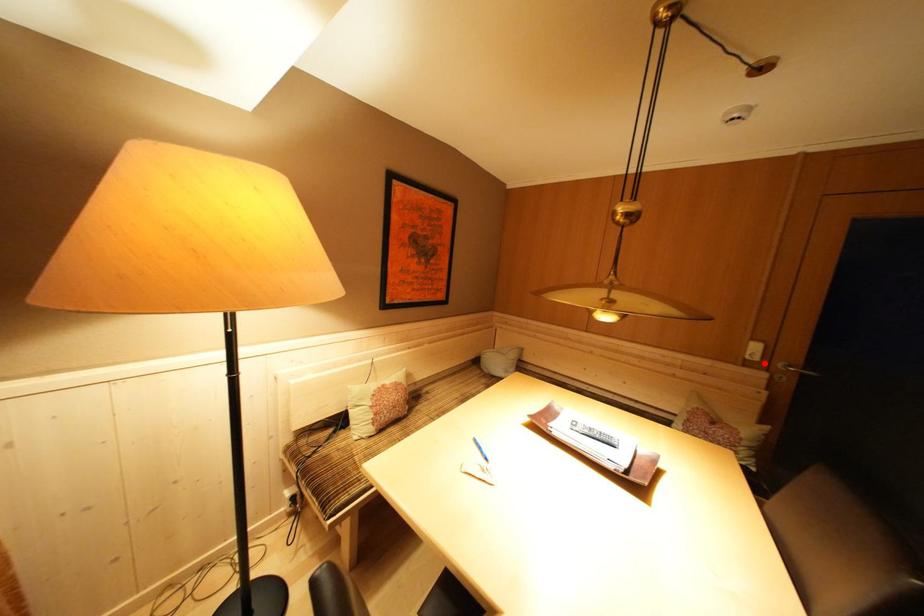
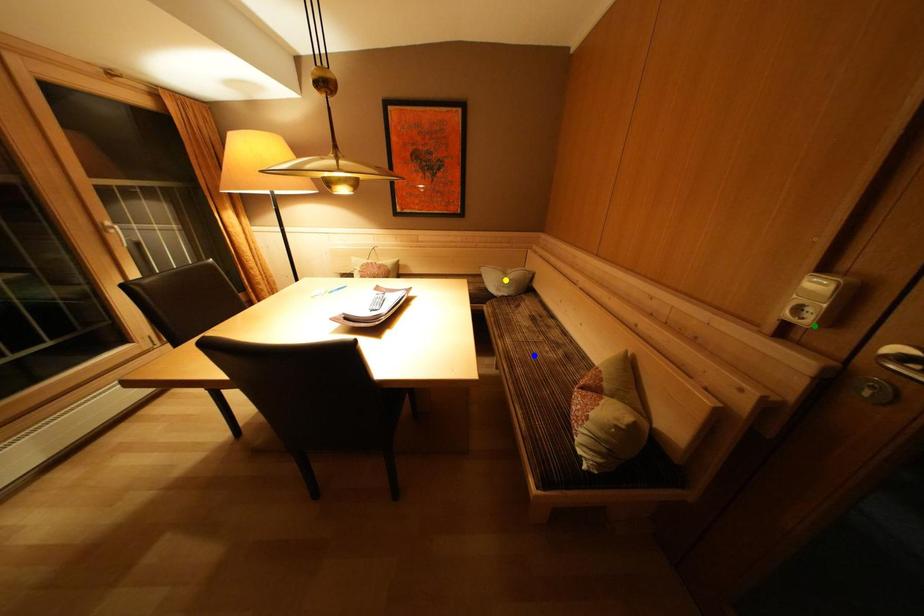
Question: I am providing you with two images of the same scene from different viewpoints. A red point is marked on the first image. You are given multiple points on the second image. In image 2, which mark is for the same physical point as the one in image 1?

Choices:
 (A) yellow point
 (B) blue point
 (C) green point

Answer: (C)